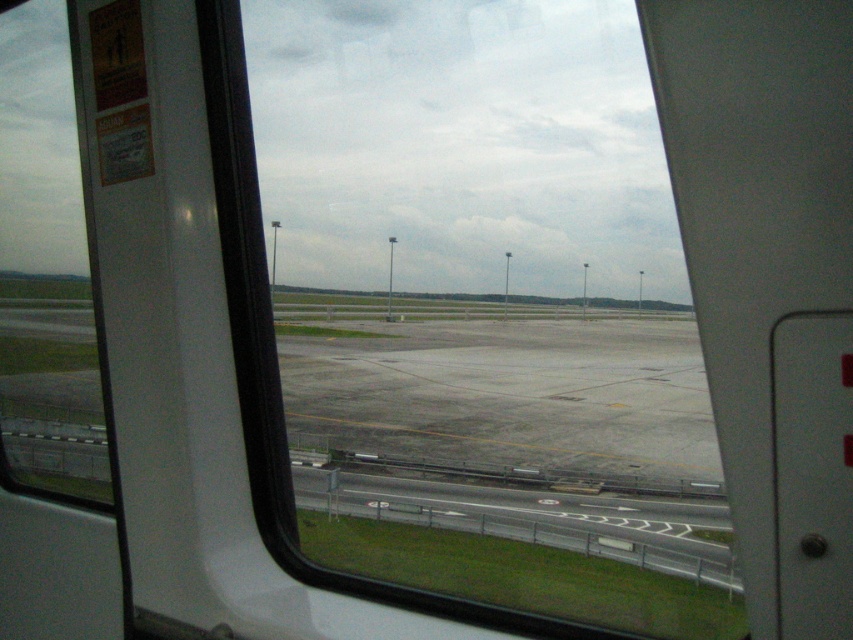
Does transparent glass window at center appear under transparent glass window at left?

Yes.

Does point (392, 314) come in front of point (0, 332)?

No, (392, 314) is further to viewer.

Does point (595, 250) come behind point (62, 228)?

Yes, point (595, 250) is farther from viewer.

Locate an element on the screen. transparent glass window at center is located at coordinates (486, 310).